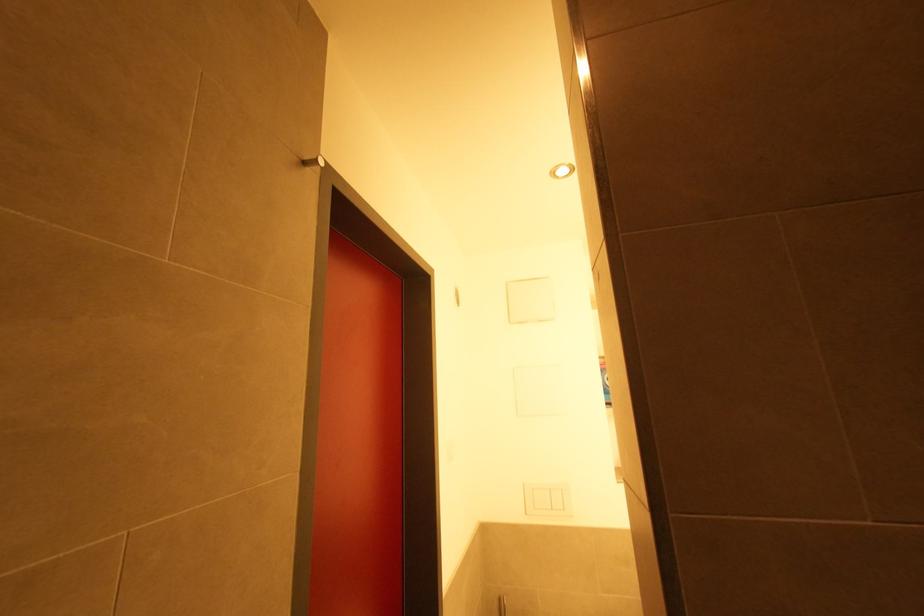
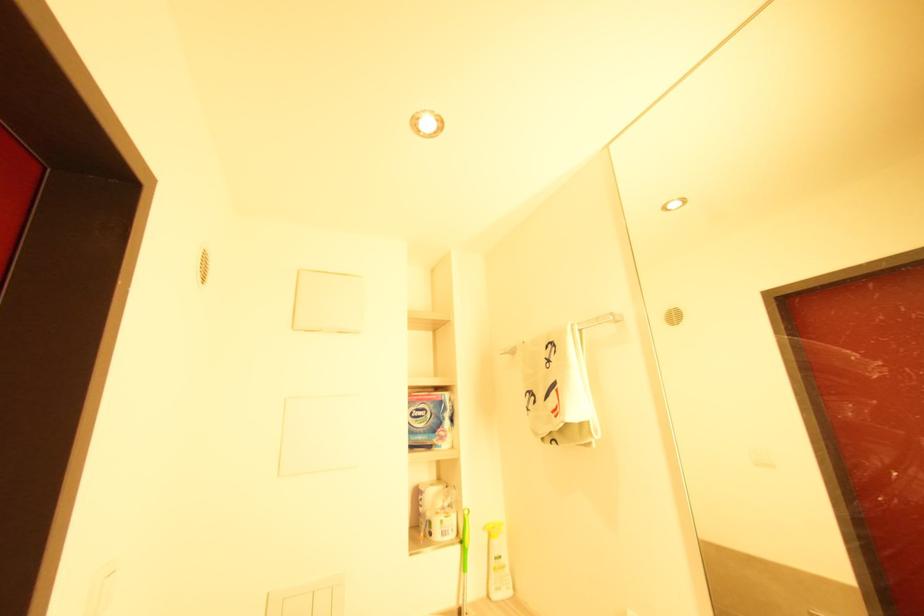
Question: The camera is either moving clockwise (left) or counter-clockwise (right) around the object. The first image is from the beginning of the video and the second image is from the end. Is the camera moving left or right when shooting the video?

Choices:
 (A) Left
 (B) Right

Answer: (A)